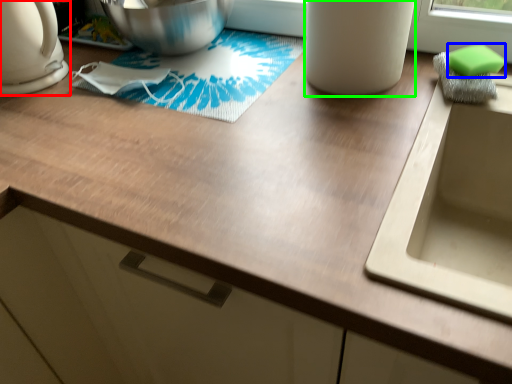
Question: Estimate the real-world distances between objects in this image. Which object is farther from kitchen appliance (highlighted by a red box), soap (highlighted by a blue box) or appliance (highlighted by a green box)?

Choices:
 (A) soap
 (B) appliance

Answer: (A)